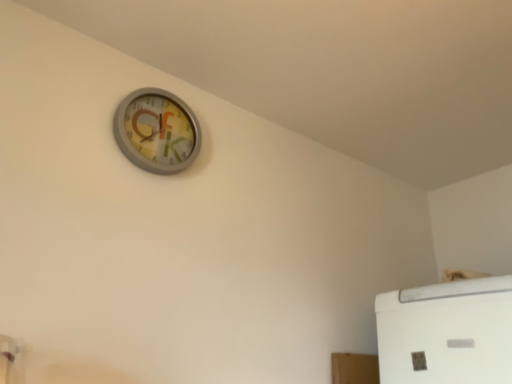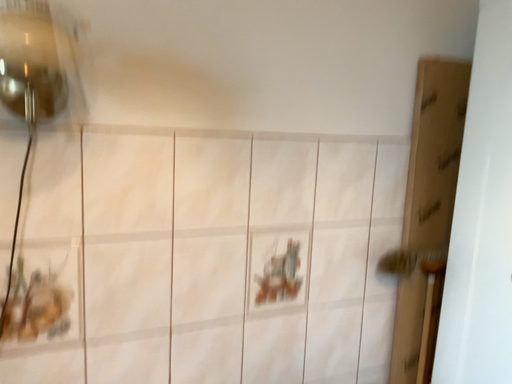
Question: Which way did the camera rotate in the video?

Choices:
 (A) rotated right
 (B) rotated left

Answer: (B)